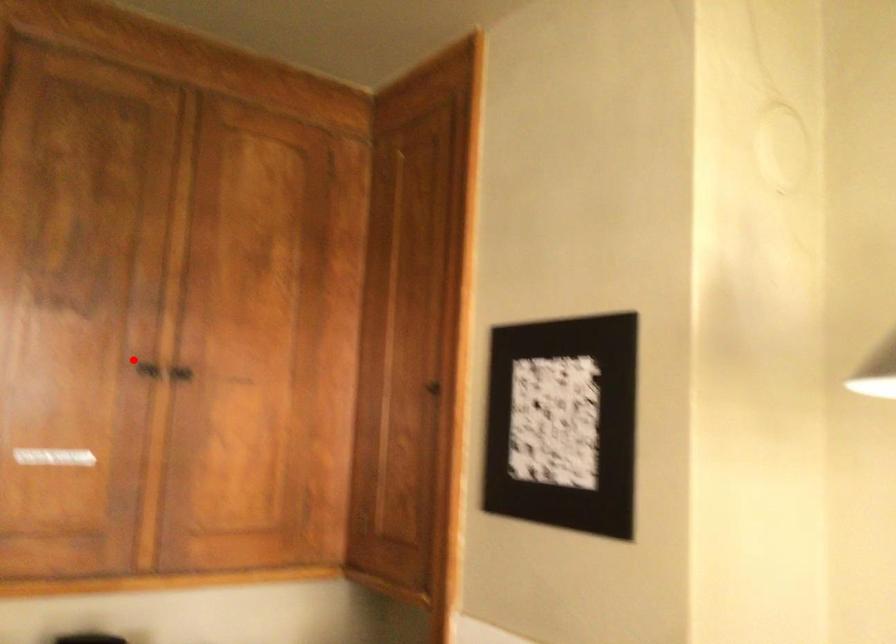
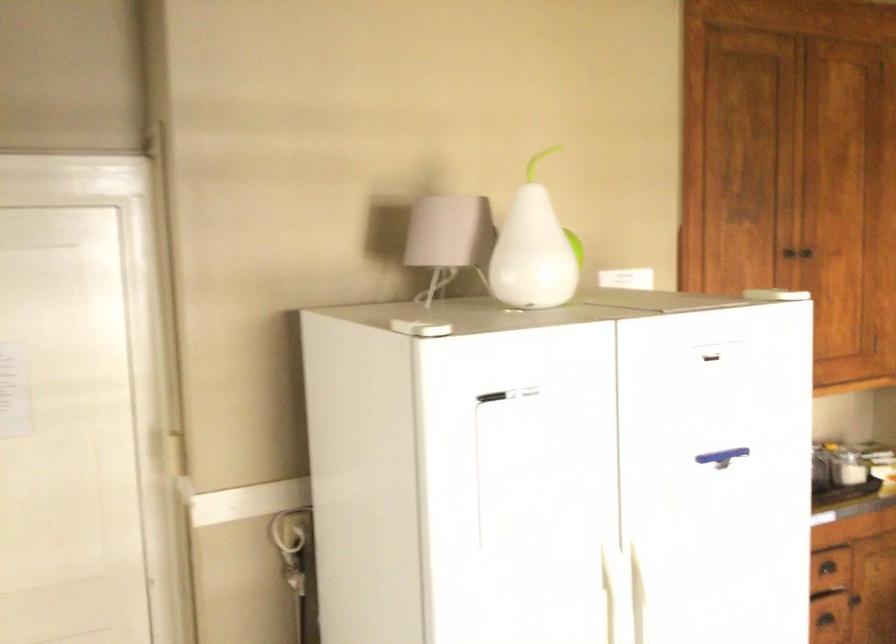
Question: A red point is marked in image1. In image2, is the corresponding 3D point closer to the camera or farther? Reply with the corresponding letter.

Choices:
 (A) The corresponding 3D point is closer.
 (B) The corresponding 3D point is farther.

Answer: (B)